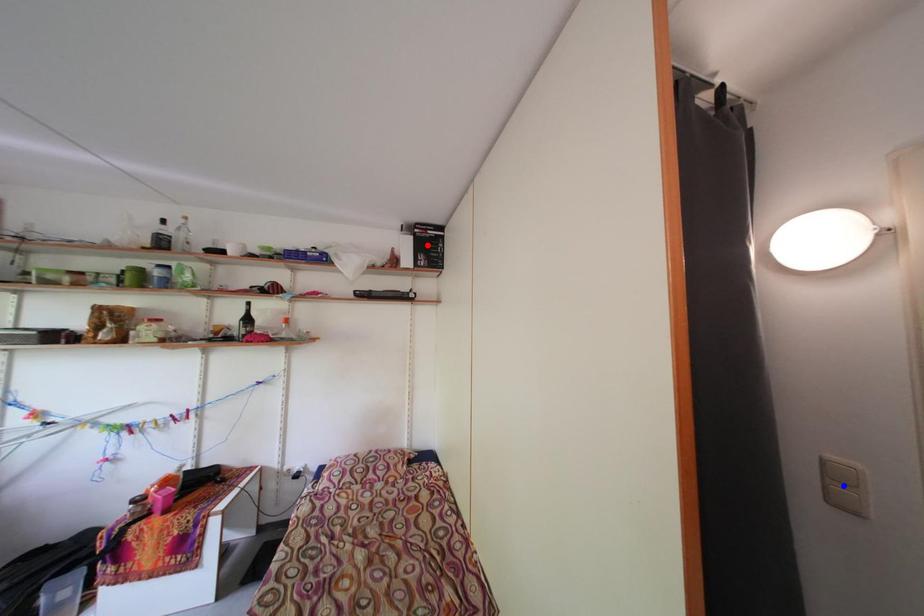
Question: Which of the two points in the image is closer to the camera?

Choices:
 (A) Blue point is closer.
 (B) Red point is closer.

Answer: (A)